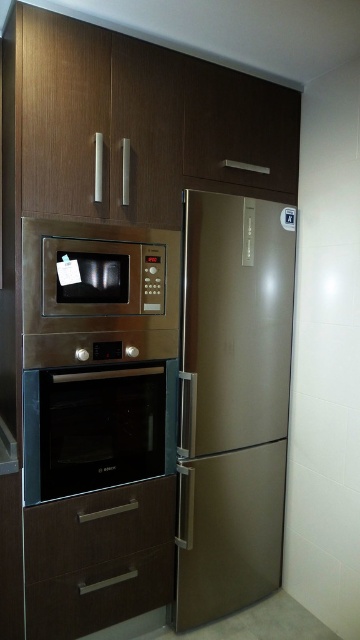
You are standing in the kitchen and need to reach both the gold metallic refrigerator at center and the brown wood drawer at lower center. Which one is closer to your right side?

The gold metallic refrigerator at center is to the right of the brown wood drawer at lower center, so it is closer to your right side.

You are trying to place a 7 inch wide cutting board between the stainless steel oven at center and the brown wood drawer at lower center. Will it fit?

The stainless steel oven at center is 7.31 inches from the brown wood drawer at lower center. Since the cutting board is 7 inches wide, it should fit with a small amount of space remaining.